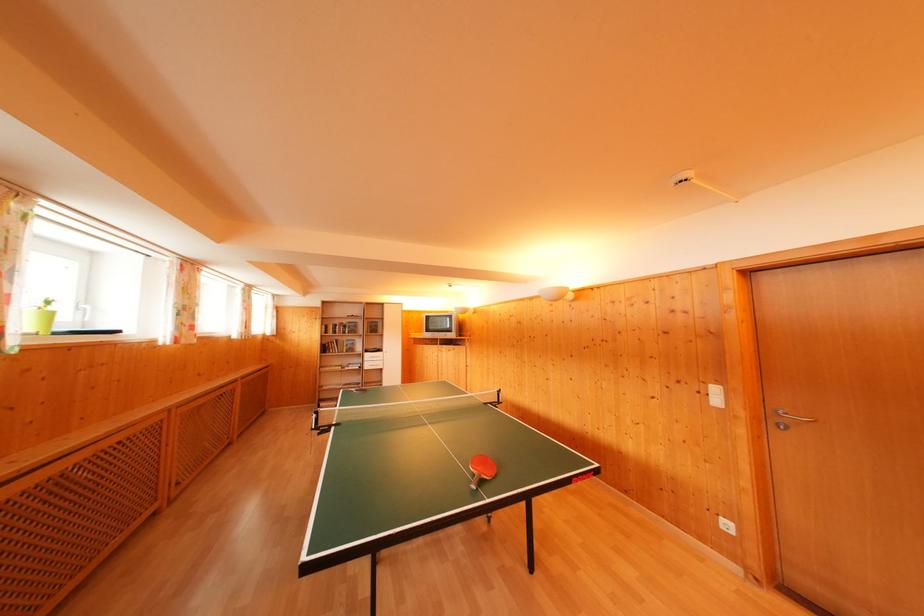
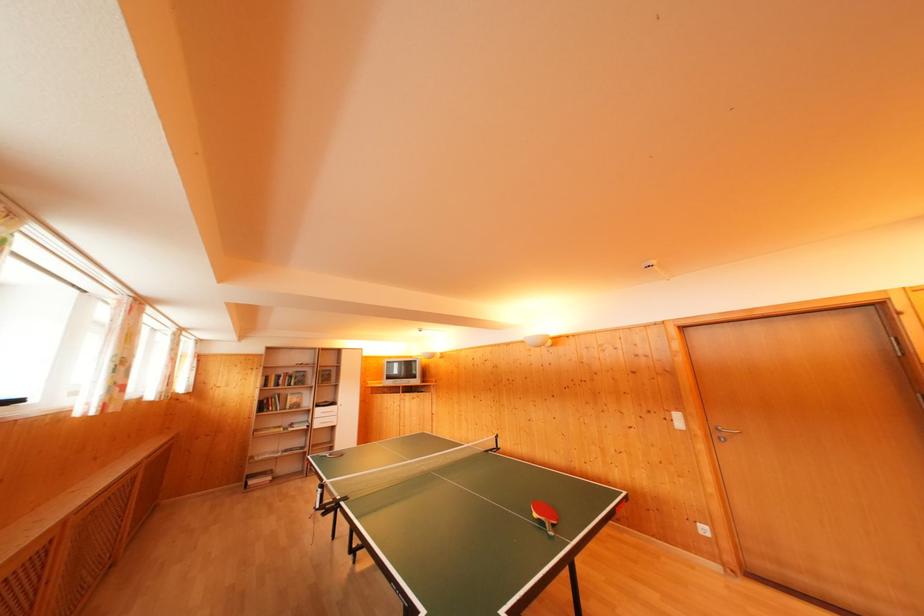
Question: Which direction would the cameraman need to move to produce the second image? Reply with the corresponding letter.

Choices:
 (A) Left
 (B) Right
 (C) Forward
 (D) Backward

Answer: (A)